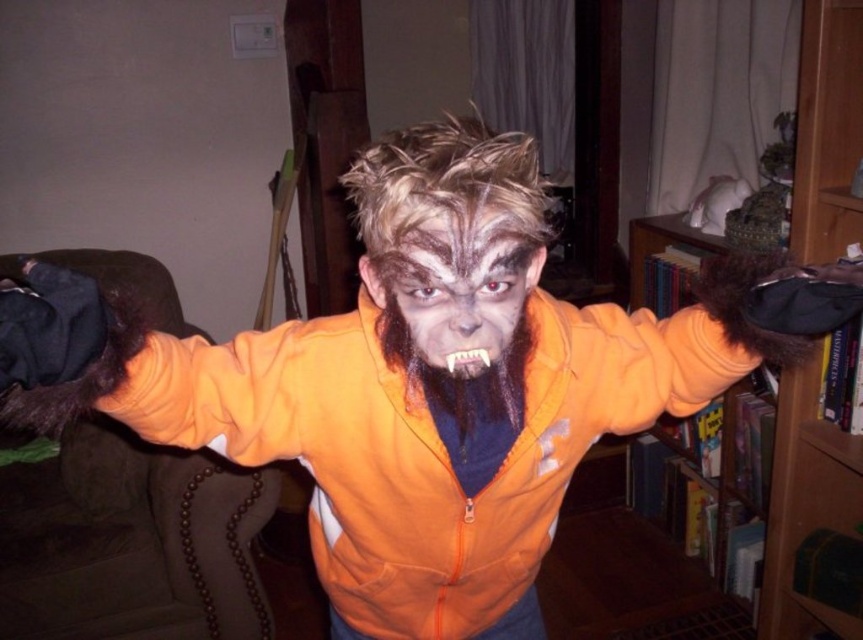
You are standing in front of the person dressed as a werewolf. You notice two points marked on their costume. The first point is at coordinate point (x=794, y=384) and the second point is at coordinate point (x=463, y=397). Which point is closer to you?

Point (x=463, y=397) is closer to you because it is in front of point (x=794, y=384).

You are standing in the scene and want to place a small decorative item on the wooden bookshelf at right. Where should you place it?

The wooden bookshelf at right is located at the 2D coordinates point (x=805, y=502) so place the item there.